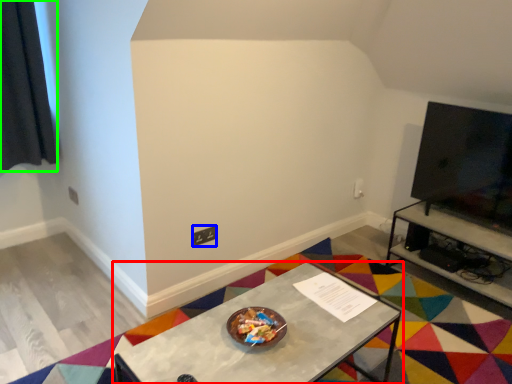
Question: Based on their relative distances, which object is farther from table (highlighted by a red box)? Choose from square (highlighted by a blue box) and curtain (highlighted by a green box).

Choices:
 (A) square
 (B) curtain

Answer: (B)